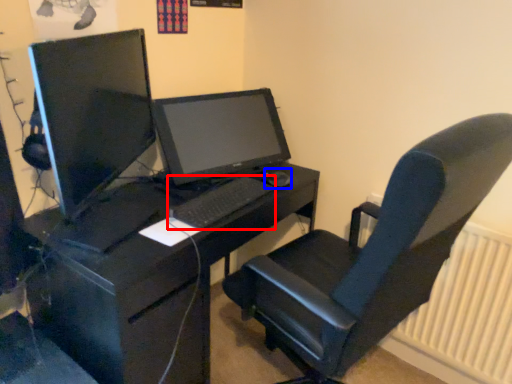
Question: Which object appears closest to the camera in this image, computer keyboard (highlighted by a red box) or mouse (highlighted by a blue box)?

Choices:
 (A) computer keyboard
 (B) mouse

Answer: (A)